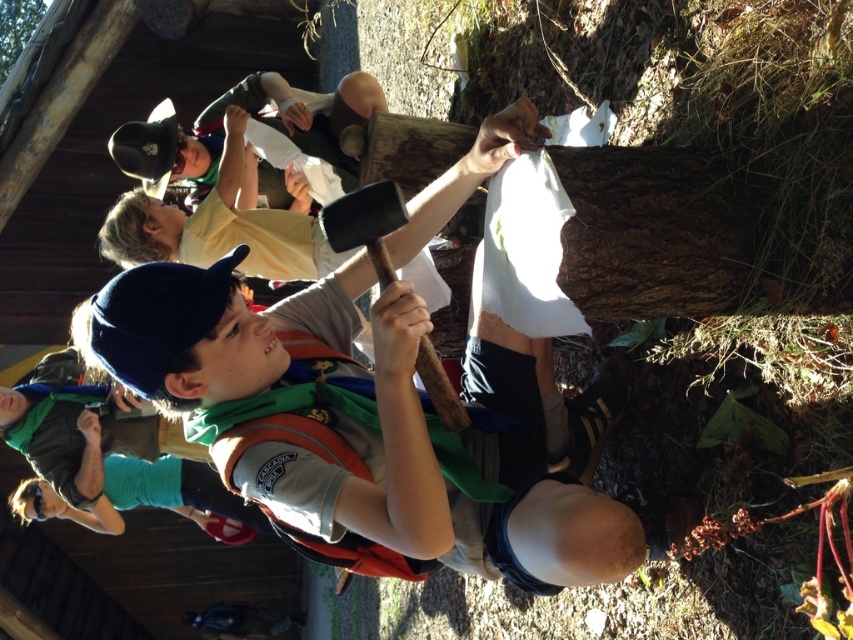
Question: Is matte orange vest at center positioned at the back of green fabric shirt at lower left?

Choices:
 (A) no
 (B) yes

Answer: (A)

Question: Does matte orange vest at center appear under green fabric shirt at lower left?

Choices:
 (A) yes
 (B) no

Answer: (B)

Question: Which point is closer to the camera?

Choices:
 (A) (85, 513)
 (B) (314, 320)

Answer: (B)

Question: Does matte orange vest at center appear under green fabric shirt at lower left?

Choices:
 (A) no
 (B) yes

Answer: (A)

Question: Which object is closer to the camera taking this photo?

Choices:
 (A) green fabric shirt at lower left
 (B) matte orange vest at center

Answer: (B)